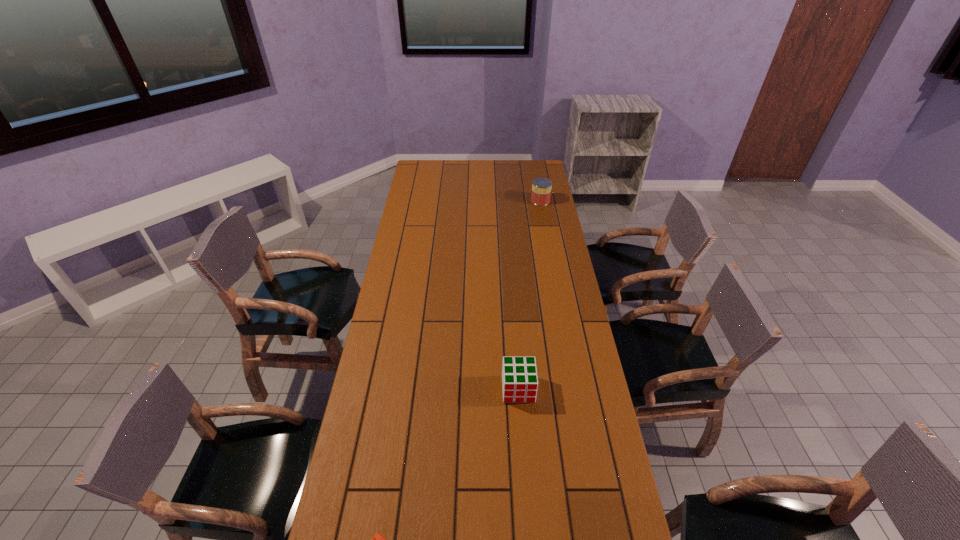
The width and height of the screenshot is (960, 540). I want to click on the rightmost object, so click(541, 187).

Image resolution: width=960 pixels, height=540 pixels. I want to click on can, so click(x=541, y=187).

At what (x,y) coordinates should I click in order to perform the action: click on the taller cube. Please return your answer as a coordinate pair (x, y). This screenshot has height=540, width=960. Looking at the image, I should click on (519, 375).

You are a GUI agent. You are given a task and a screenshot of the screen. Output one action in this format:
    pyautogui.click(x=<x>, y=<y>)
    Task: Click on the second object from left to right
    The image size is (960, 540).
    Given the screenshot: What is the action you would take?
    pyautogui.click(x=519, y=375)

Where is `blank space located on the front of the can`? This screenshot has width=960, height=540. blank space located on the front of the can is located at coordinates (549, 245).

Locate an element on the screen. The height and width of the screenshot is (540, 960). vacant space located on the red face of the taller cube is located at coordinates (524, 470).

At what (x,y) coordinates should I click in order to perform the action: click on object located at the right edge. Please return your answer as a coordinate pair (x, y). This screenshot has width=960, height=540. Looking at the image, I should click on (541, 187).

Image resolution: width=960 pixels, height=540 pixels. I want to click on free spot at the left edge of the desktop, so click(x=414, y=326).

Locate an element on the screen. This screenshot has height=540, width=960. free space at the right edge is located at coordinates (550, 253).

At what (x,y) coordinates should I click in order to perform the action: click on free space at the far left corner of the desktop. Please return your answer as a coordinate pair (x, y). Looking at the image, I should click on (439, 178).